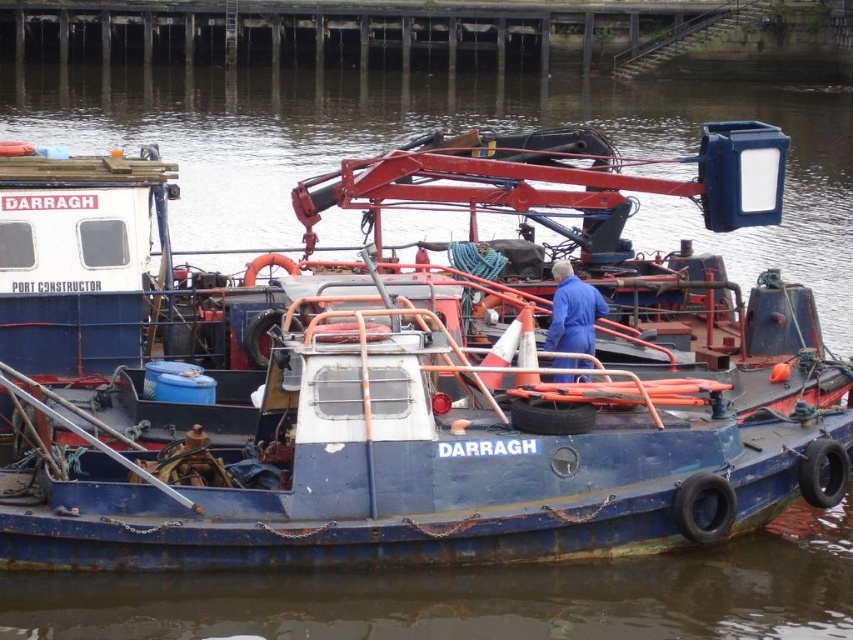
Which of these two, blue matte boat at center or blue smooth coveralls at center, stands shorter?

With less height is blue smooth coveralls at center.

Who is lower down, blue matte boat at center or blue smooth coveralls at center?

blue smooth coveralls at center is lower down.

The width and height of the screenshot is (853, 640). In order to click on blue matte boat at center in this screenshot , I will do `click(409, 376)`.